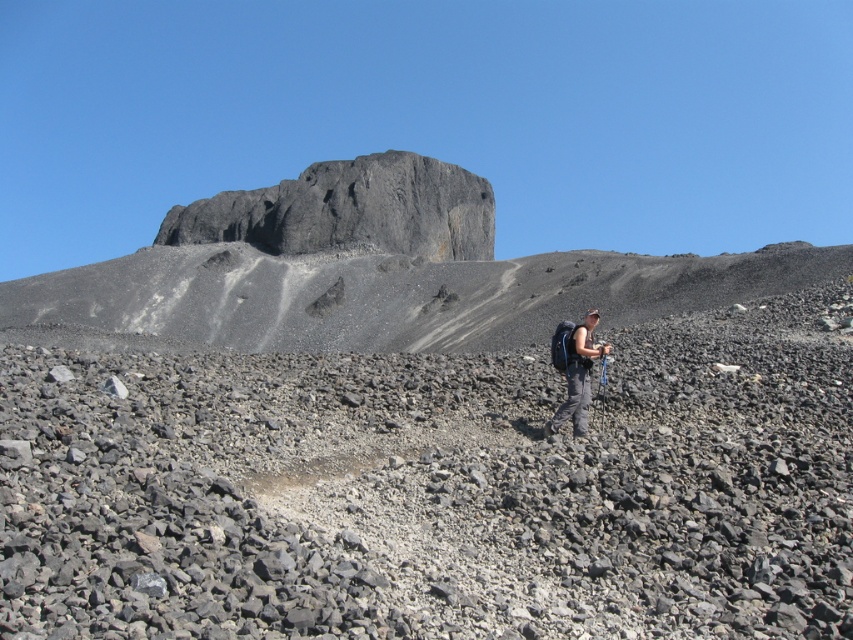
Does gray gravelly rocks at center have a larger size compared to matte gray backpack at center?

Indeed, gray gravelly rocks at center has a larger size compared to matte gray backpack at center.

Who is more distant from viewer, (129, 403) or (575, 355)?

Point (575, 355)

At what (x,y) coordinates should I click in order to perform the action: click on gray gravelly rocks at center. Please return your answer as a coordinate pair (x, y). Looking at the image, I should click on (439, 488).

Does dark gray rock formation at upper center come behind matte gray backpack at center?

Yes, it is behind matte gray backpack at center.

This screenshot has height=640, width=853. What are the coordinates of `dark gray rock formation at upper center` in the screenshot? It's located at (376, 269).

Image resolution: width=853 pixels, height=640 pixels. Describe the element at coordinates (376, 269) in the screenshot. I see `dark gray rock formation at upper center` at that location.

Identify the location of dark gray rock formation at upper center. This screenshot has width=853, height=640. (376, 269).

Can you confirm if gray gravelly rocks at center is smaller than dark gray rock formation at upper center?

Yes.

Where is `gray gravelly rocks at center`? gray gravelly rocks at center is located at coordinates (439, 488).

Identify the location of gray gravelly rocks at center. (439, 488).

At what (x,y) coordinates should I click in order to perform the action: click on gray gravelly rocks at center. Please return your answer as a coordinate pair (x, y). This screenshot has width=853, height=640. Looking at the image, I should click on click(x=439, y=488).